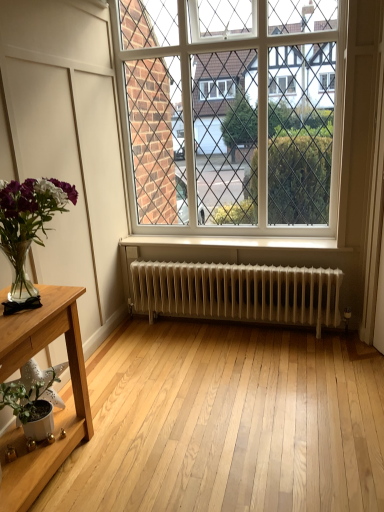
The height and width of the screenshot is (512, 384). In order to click on white metallic radiator at center in this screenshot , I will do `click(238, 293)`.

Describe the element at coordinates (29, 222) in the screenshot. I see `translucent glass vase at left, the second houseplant when ordered from bottom to top` at that location.

Locate an element on the screen. The height and width of the screenshot is (512, 384). white glass window at center is located at coordinates (227, 104).

The image size is (384, 512). Describe the element at coordinates (57, 411) in the screenshot. I see `light wood table at lower left` at that location.

Find the location of a particular element. The image size is (384, 512). white metallic radiator at center is located at coordinates (238, 293).

How many degrees apart are the facing directions of white matte pot at lower left, the first houseplant when ordered from bottom to top, and light wood table at lower left?

There is a 0.793-degree angle between the facing directions of white matte pot at lower left, the first houseplant when ordered from bottom to top, and light wood table at lower left.

From the image's perspective, which is above, white matte pot at lower left, acting as the second houseplant starting from the top, or light wood table at lower left?

Answer: light wood table at lower left, from the image's perspective.

Considering the sizes of objects white matte pot at lower left, the first houseplant when ordered from bottom to top, and light wood table at lower left in the image provided, who is smaller, white matte pot at lower left, the first houseplant when ordered from bottom to top, or light wood table at lower left?

white matte pot at lower left, the first houseplant when ordered from bottom to top, is smaller.

Is white matte pot at lower left, acting as the second houseplant starting from the top, bigger than white metallic radiator at center?

No.

Is white matte pot at lower left, acting as the second houseplant starting from the top, positioned far away from white metallic radiator at center?

A: white matte pot at lower left, acting as the second houseplant starting from the top, is positioned a significant distance from white metallic radiator at center.

Does point (25, 384) come behind point (256, 278)?

No.

Is white metallic radiator at center positioned with its back to white matte pot at lower left, acting as the second houseplant starting from the top?

No, white matte pot at lower left, acting as the second houseplant starting from the top, is not at the back of white metallic radiator at center.

Is white metallic radiator at center spatially inside white matte pot at lower left, the first houseplant when ordered from bottom to top, or outside of it?

white metallic radiator at center exists outside the volume of white matte pot at lower left, the first houseplant when ordered from bottom to top.

Does point (159, 290) lie behind point (18, 421)?

Yes, point (159, 290) is behind point (18, 421).

In the image, is white metallic radiator at center on the left side or the right side of white glass window at center?

Clearly, white metallic radiator at center is on the right of white glass window at center in the image.

Is white metallic radiator at center oriented away from white glass window at center?

No, white metallic radiator at center's orientation is not away from white glass window at center.

From a real-world perspective, between white metallic radiator at center and white glass window at center, who is vertically higher?

white glass window at center is physically above.

Which of these two, light wood table at lower left or white metallic radiator at center, is smaller?

Smaller between the two is white metallic radiator at center.

Is light wood table at lower left further to the viewer compared to white metallic radiator at center?

No, light wood table at lower left is in front of white metallic radiator at center.

Which of these two, light wood table at lower left or white metallic radiator at center, is thinner?

Thinner between the two is white metallic radiator at center.

Can white metallic radiator at center be found inside light wood table at lower left?

Actually, white metallic radiator at center is outside light wood table at lower left.

Is point (214, 69) farther from viewer compared to point (24, 316)?

Yes, point (214, 69) is farther from viewer.

Consider the image. From the image's perspective, is white glass window at center over light wood table at lower left?

Yes, from the image's perspective, white glass window at center is above light wood table at lower left.

Where is `table below the white glass window at center (from a real-world perspective)`? The height and width of the screenshot is (512, 384). table below the white glass window at center (from a real-world perspective) is located at coordinates (57, 411).

Does white glass window at center have a lesser height compared to light wood table at lower left?

No, white glass window at center is not shorter than light wood table at lower left.

Is light wood table at lower left taller or shorter than translucent glass vase at left, the second houseplant when ordered from bottom to top?

light wood table at lower left is taller than translucent glass vase at left, the second houseplant when ordered from bottom to top.

Is point (15, 484) positioned before point (20, 239)?

Yes, point (15, 484) is in front of point (20, 239).

Is light wood table at lower left spatially inside translucent glass vase at left, the first houseplant positioned from the top, or outside of it?

light wood table at lower left cannot be found inside translucent glass vase at left, the first houseplant positioned from the top.

Is light wood table at lower left not close to translucent glass vase at left, the first houseplant positioned from the top?

light wood table at lower left is actually quite close to translucent glass vase at left, the first houseplant positioned from the top.

Identify the location of table lying in front of the white matte pot at lower left, acting as the second houseplant starting from the top. (57, 411).

The height and width of the screenshot is (512, 384). In order to click on radiator that appears below the white matte pot at lower left, the first houseplant when ordered from bottom to top (from a real-world perspective) in this screenshot , I will do `click(238, 293)`.

Based on their spatial positions, is white matte pot at lower left, acting as the second houseplant starting from the top, or white metallic radiator at center closer to translucent glass vase at left, the second houseplant when ordered from bottom to top?

The object closer to translucent glass vase at left, the second houseplant when ordered from bottom to top, is white matte pot at lower left, acting as the second houseplant starting from the top.

Looking at this image, considering their positions, is translucent glass vase at left, the first houseplant positioned from the top, positioned further to white glass window at center than white matte pot at lower left, the first houseplant when ordered from bottom to top?

Among the two, white matte pot at lower left, the first houseplant when ordered from bottom to top, is located further to white glass window at center.

Looking at the image, which one is located closer to translucent glass vase at left, the second houseplant when ordered from bottom to top, white matte pot at lower left, the first houseplant when ordered from bottom to top, or white glass window at center?

Based on the image, white matte pot at lower left, the first houseplant when ordered from bottom to top, appears to be nearer to translucent glass vase at left, the second houseplant when ordered from bottom to top.

Estimate the real-world distances between objects in this image. Which object is further from light wood table at lower left, white matte pot at lower left, acting as the second houseplant starting from the top, or white glass window at center?

The object further to light wood table at lower left is white glass window at center.

From the image, which object appears to be nearer to white matte pot at lower left, acting as the second houseplant starting from the top, light wood table at lower left or white glass window at center?

light wood table at lower left lies closer to white matte pot at lower left, acting as the second houseplant starting from the top, than the other object.

Estimate the real-world distances between objects in this image. Which object is closer to white glass window at center, white metallic radiator at center or white matte pot at lower left, acting as the second houseplant starting from the top?

white metallic radiator at center lies closer to white glass window at center than the other object.

Looking at the image, which one is located further to white glass window at center, light wood table at lower left or translucent glass vase at left, the first houseplant positioned from the top?

light wood table at lower left lies further to white glass window at center than the other object.

Estimate the real-world distances between objects in this image. Which object is closer to translucent glass vase at left, the second houseplant when ordered from bottom to top, white glass window at center or white matte pot at lower left, the first houseplant when ordered from bottom to top?

white matte pot at lower left, the first houseplant when ordered from bottom to top, is positioned closer to the anchor translucent glass vase at left, the second houseplant when ordered from bottom to top.

Image resolution: width=384 pixels, height=512 pixels. Identify the location of window located between translucent glass vase at left, the first houseplant positioned from the top, and white metallic radiator at center in the depth direction. (227, 104).

Image resolution: width=384 pixels, height=512 pixels. In order to click on houseplant that lies between white glass window at center and white matte pot at lower left, the first houseplant when ordered from bottom to top, from top to bottom in this screenshot , I will do `click(29, 222)`.

Identify the location of table between white glass window at center and white matte pot at lower left, acting as the second houseplant starting from the top, from top to bottom. (57, 411).

You are a GUI agent. You are given a task and a screenshot of the screen. Output one action in this format:
    pyautogui.click(x=<x>, y=<y>)
    Task: Click on the table between translucent glass vase at left, the second houseplant when ordered from bottom to top, and white matte pot at lower left, the first houseplant when ordered from bottom to top, vertically
    The width and height of the screenshot is (384, 512).
    Given the screenshot: What is the action you would take?
    pyautogui.click(x=57, y=411)